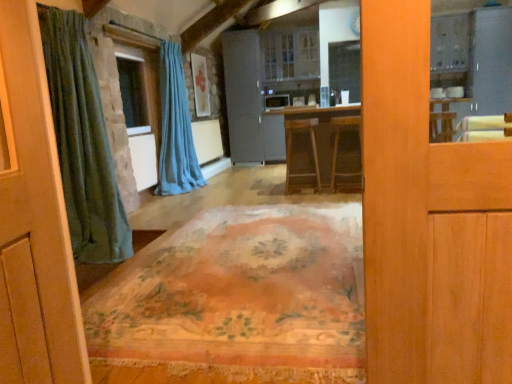
Find the location of a particular element. The height and width of the screenshot is (384, 512). free region on the left part of wooden stool at center, which appears as the first furniture when viewed from the left is located at coordinates (268, 194).